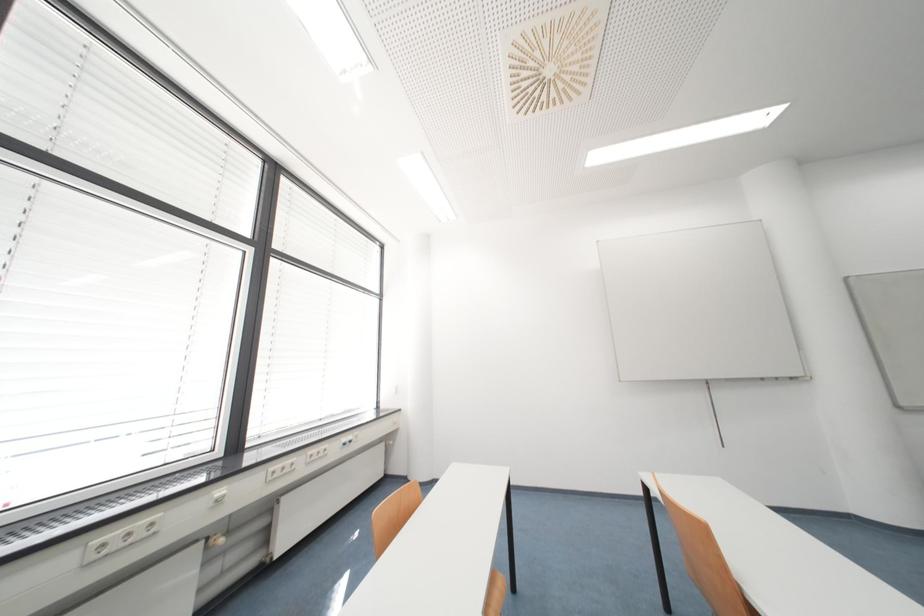
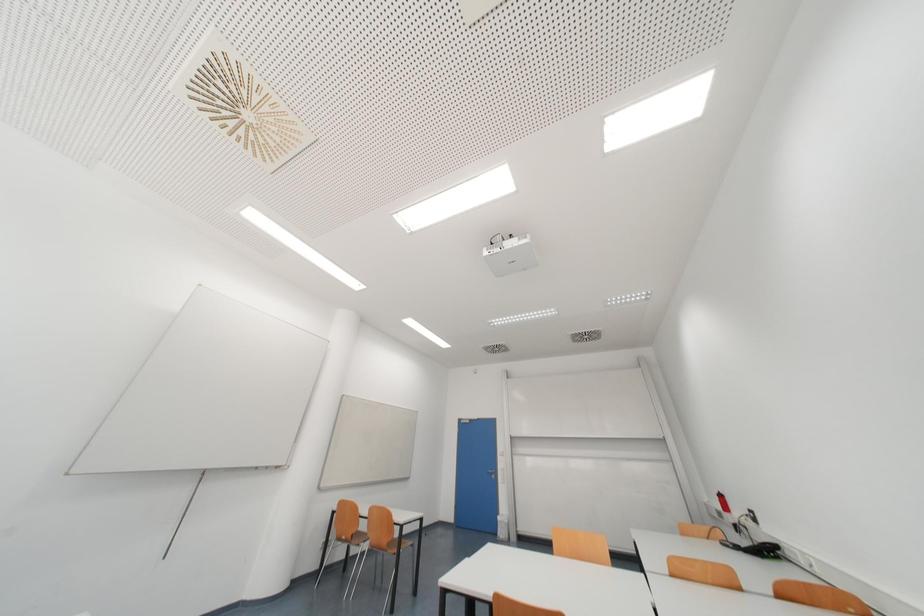
The first image is from the beginning of the video and the second image is from the end. How did the camera likely rotate when shooting the video?

The camera rotated toward right-up.